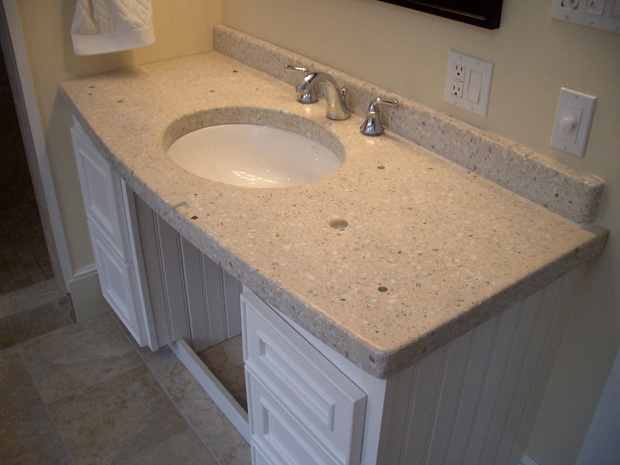
Locate an element on the screen. This screenshot has width=620, height=465. bathroom sink is located at coordinates (260, 156).